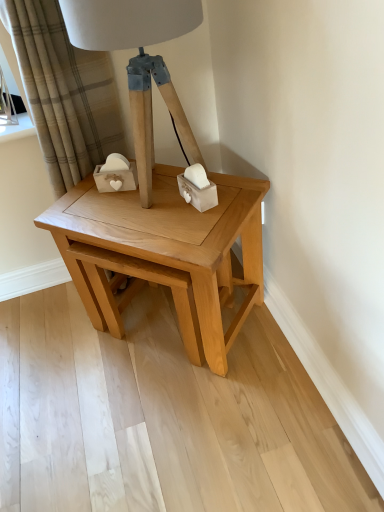
Locate an element on the screen. vacant space that is to the left of natural wood table at center is located at coordinates (56, 360).